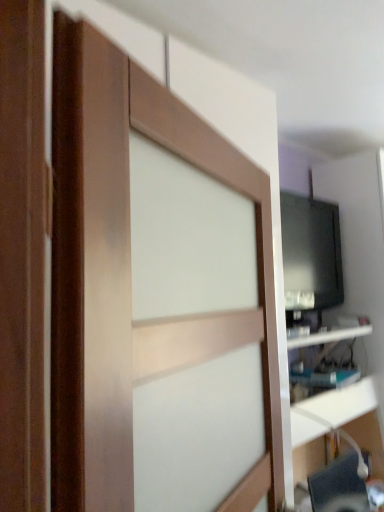
Question: Can you confirm if black glossy monitor at right is bigger than black glossy tv at upper right?

Choices:
 (A) yes
 (B) no

Answer: (B)

Question: Is black glossy monitor at right not inside black glossy tv at upper right?

Choices:
 (A) yes
 (B) no

Answer: (A)

Question: Would you say black glossy tv at upper right is part of black glossy monitor at right's contents?

Choices:
 (A) yes
 (B) no

Answer: (B)

Question: Is black glossy monitor at right wider than black glossy tv at upper right?

Choices:
 (A) yes
 (B) no

Answer: (B)

Question: Is black glossy monitor at right next to black glossy tv at upper right?

Choices:
 (A) no
 (B) yes

Answer: (A)

Question: Is point (284, 283) positioned closer to the camera than point (67, 452)?

Choices:
 (A) farther
 (B) closer

Answer: (A)

Question: Considering the positions of black glossy monitor at right and wooden barn door at center in the image, is black glossy monitor at right taller or shorter than wooden barn door at center?

Choices:
 (A) tall
 (B) short

Answer: (B)

Question: Is black glossy monitor at right spatially inside wooden barn door at center, or outside of it?

Choices:
 (A) outside
 (B) inside

Answer: (A)

Question: Looking at their shapes, would you say black glossy monitor at right is wider or thinner than wooden barn door at center?

Choices:
 (A) wide
 (B) thin

Answer: (B)

Question: In terms of width, does black glossy tv at upper right look wider or thinner when compared to white glossy shelf at right?

Choices:
 (A) wide
 (B) thin

Answer: (A)

Question: In the image, is black glossy tv at upper right on the left side or the right side of white glossy shelf at right?

Choices:
 (A) right
 (B) left

Answer: (A)

Question: Which is correct: black glossy tv at upper right is inside white glossy shelf at right, or outside of it?

Choices:
 (A) outside
 (B) inside

Answer: (A)

Question: Is point (357, 294) positioned closer to the camera than point (337, 336)?

Choices:
 (A) closer
 (B) farther

Answer: (B)

Question: In terms of width, does wooden barn door at center look wider or thinner when compared to black glossy tv at upper right?

Choices:
 (A) wide
 (B) thin

Answer: (B)

Question: From a real-world perspective, relative to black glossy tv at upper right, is wooden barn door at center vertically above or below?

Choices:
 (A) below
 (B) above

Answer: (B)